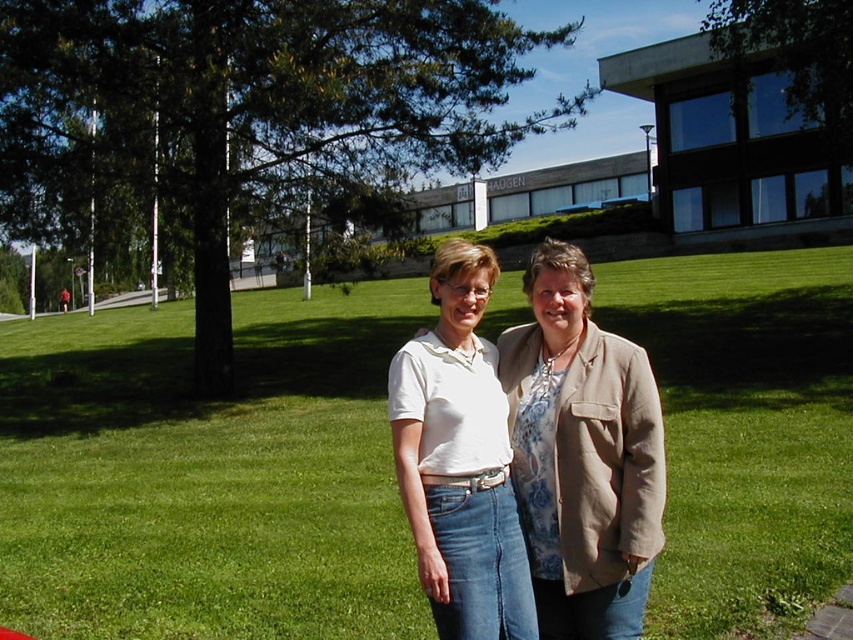
You are standing at the origin point in the image. Which direction should you move to reach the green grass at center?

The green grass at center is located at coordinates point (207, 476). Since the origin is at the bottom left corner of the image, moving towards the upper right direction will lead you to the green grass at center.

You are standing in the grassy area and want to take a photo of the two people. The two points, point (4, 513) and point (657, 477), are markers for where you should position your camera. Which point is closer to you?

Point (4, 513) is further to the viewer than point (657, 477), so the closer point to you is point (657, 477).